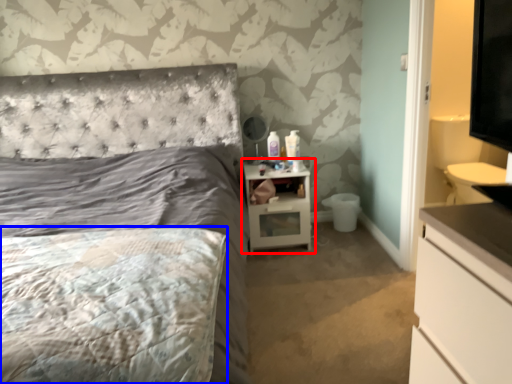
Question: Among these objects, which one is nearest to the camera, nightstand (highlighted by a red box) or mattress (highlighted by a blue box)?

Choices:
 (A) nightstand
 (B) mattress

Answer: (B)